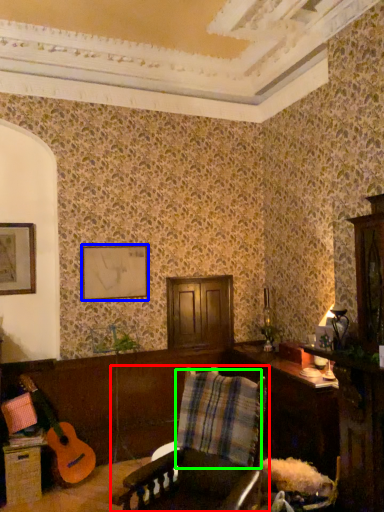
Question: Which is nearer to the chair (highlighted by a red box)? picture frame (highlighted by a blue box) or plaid (highlighted by a green box).

Choices:
 (A) picture frame
 (B) plaid

Answer: (B)